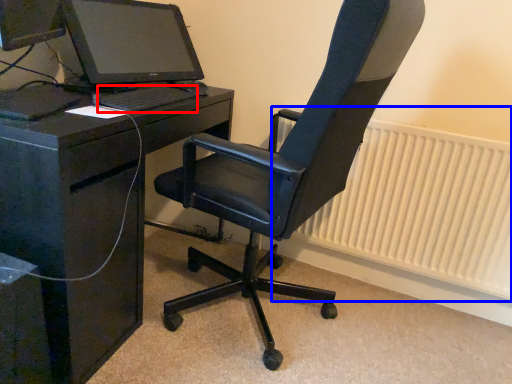
Question: Which object appears farthest to the camera in this image, computer keyboard (highlighted by a red box) or radiator (highlighted by a blue box)?

Choices:
 (A) computer keyboard
 (B) radiator

Answer: (B)